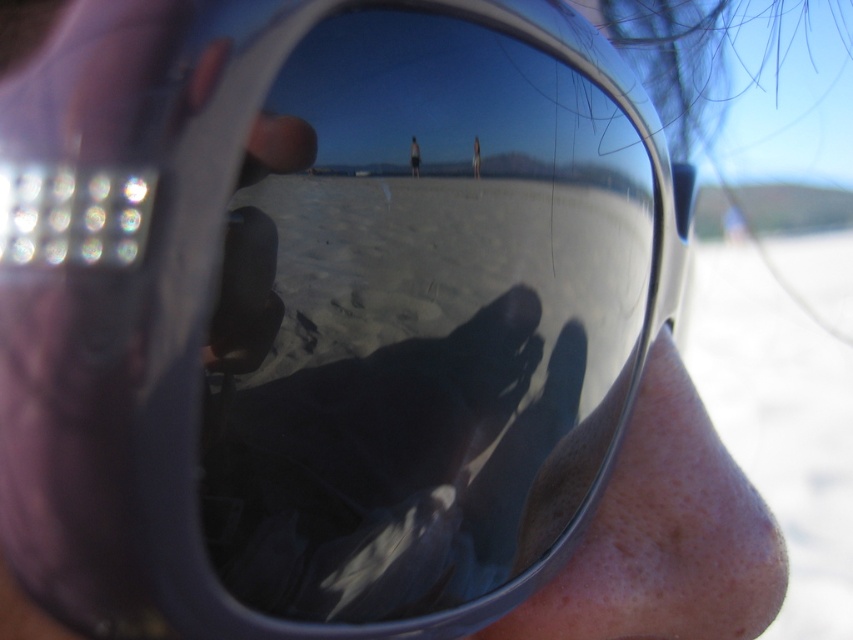
Does white sand at lower right have a larger size compared to light brown skin at center?

Yes.

How much distance is there between white sand at lower right and light brown skin at center?

white sand at lower right and light brown skin at center are 32.42 inches apart.

Which is behind, point (718, 417) or point (477, 173)?

The point (718, 417) is behind.

You are a GUI agent. You are given a task and a screenshot of the screen. Output one action in this format:
    pyautogui.click(x=<x>, y=<y>)
    Task: Click on the white sand at lower right
    The image size is (853, 640).
    Given the screenshot: What is the action you would take?
    pyautogui.click(x=779, y=420)

Is point (410, 152) closer to viewer compared to point (471, 161)?

Yes, point (410, 152) is closer to viewer.

Image resolution: width=853 pixels, height=640 pixels. Find the location of `matte black sunglasses at center`. matte black sunglasses at center is located at coordinates (415, 157).

Is point (413, 156) positioned in front of point (479, 176)?

That is True.

The width and height of the screenshot is (853, 640). In order to click on matte black sunglasses at center in this screenshot , I will do `click(415, 157)`.

The height and width of the screenshot is (640, 853). Find the location of `white sand at lower right`. white sand at lower right is located at coordinates (779, 420).

Measure the distance from white sand at lower right to matte black sunglasses at center.

A distance of 84.73 centimeters exists between white sand at lower right and matte black sunglasses at center.

Does point (822, 248) come farther from viewer compared to point (415, 156)?

Yes, it is.

Where is `white sand at lower right`? The height and width of the screenshot is (640, 853). white sand at lower right is located at coordinates (779, 420).